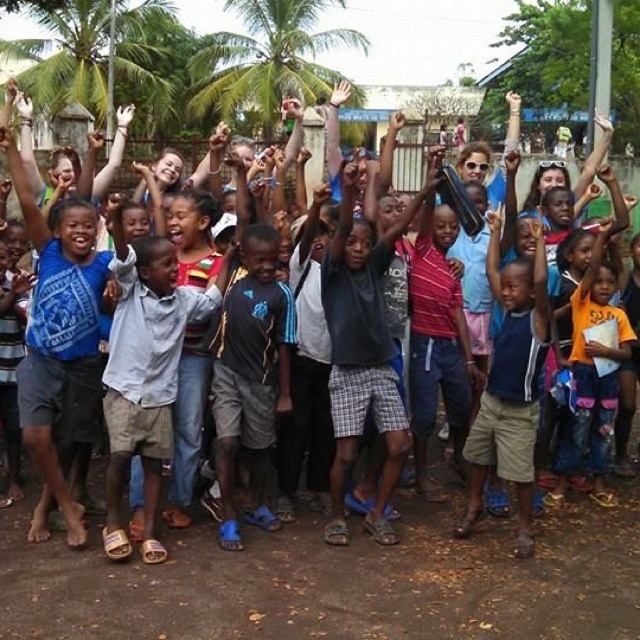
Based on the scene description, which object is smaller in size between the dark gray shorts at center and the green leafy palm tree at upper left?

The dark gray shorts at center is smaller in size compared to the green leafy palm tree at upper left according to the description.

You are a photographer trying to capture a photo of the gray plaid shorts at center. The camera you are using has a focus point at coordinate 0.5, 0.5. Will the shorts be in focus?

The gray plaid shorts at center is located at point (362,355), which is slightly offset from the camera focus point at (320,320). Therefore, the shorts will not be in focus.